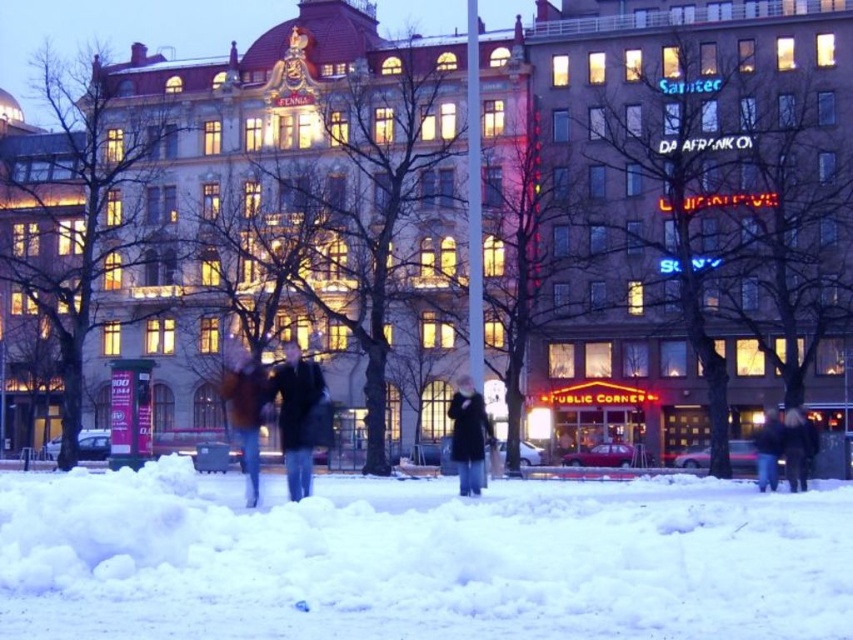
You are a photographer trying to capture the two people in the scene. You notice the dark gray coat at center and the dark blue jacket at lower right. Which person should you focus on first if you want to photograph the narrower silhouette?

The dark gray coat at center has a narrower silhouette than the dark blue jacket at lower right, so you should focus on the person in the dark gray coat at center first.

You are a delivery person needing to walk across the snow to reach the recipient at the lower right. The path requires stepping on the white fluffy snow at lower center and passing by the dark brown fur coat at lower right. Considering the size difference between these two objects, which one might be harder to walk on and why?

The white fluffy snow at lower center is larger in size compared to the dark brown fur coat at lower right. Since the snow is larger and possibly deeper, it might be harder to walk on due to its depth and softness, making it more challenging for the delivery person to navigate compared to the smaller dark brown fur coat at lower right.

You are standing at the edge of the snowfield and want to find the dark gray coat at center and the dark blue jacket at lower right. Which one is higher up in the image?

The dark gray coat at center is above the dark blue jacket at lower right, so it is higher up in the image.